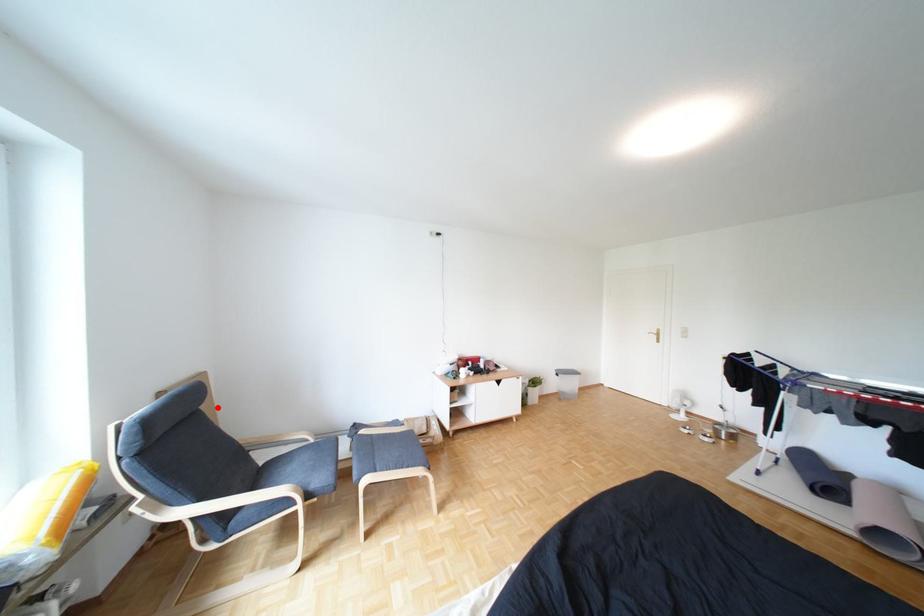
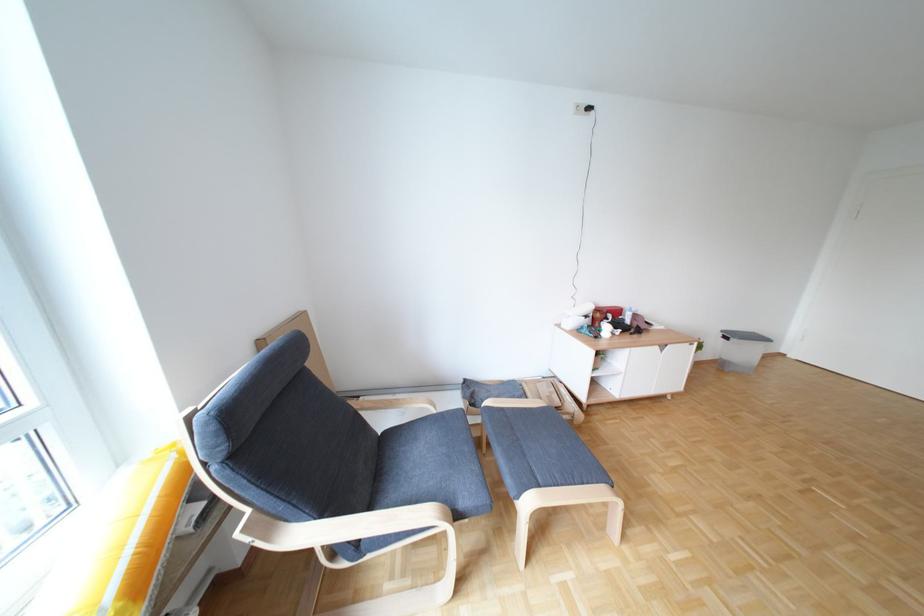
Locate, in the second image, the point that corresponds to the highlighted location in the first image.

(322, 363)